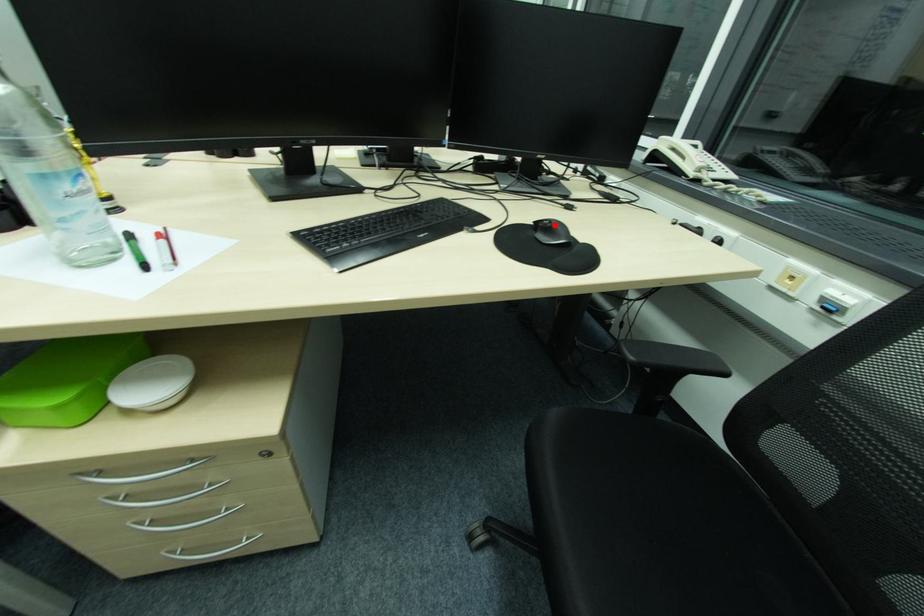
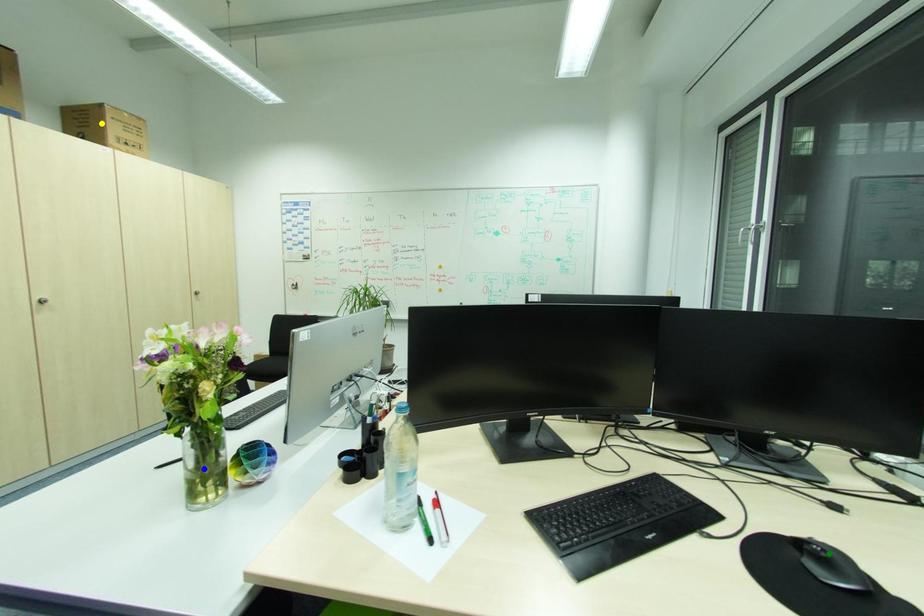
Question: I am providing you with two images of the same scene from different viewpoints. A red point is marked on the first image. You are given multiple points on the second image. Which spot in image 2 lines up with the point in image 1?

Choices:
 (A) yellow point
 (B) green point
 (C) blue point

Answer: (B)